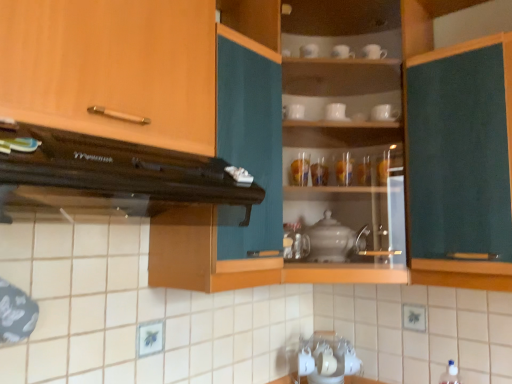
This screenshot has width=512, height=384. What do you see at coordinates (336, 112) in the screenshot? I see `white glossy cup at upper center, the third tableware viewed from the right` at bounding box center [336, 112].

What do you see at coordinates (319, 172) in the screenshot? This screenshot has width=512, height=384. I see `translucent glass vase at upper center, the 4th tableware positioned from the right` at bounding box center [319, 172].

Measure the distance between point (327, 177) and camera.

Point (327, 177) is 1.74 meters from camera.

Locate an element on the screen. Image resolution: width=512 pixels, height=384 pixels. satin silver teapot at center is located at coordinates (334, 240).

What is the approximate width of wooden cabinet at center?

The width of wooden cabinet at center is 61.81 centimeters.

What is the approximate width of white ceramic cup at upper center, marked as the 1th tableware in a right-to-left arrangement?

The width of white ceramic cup at upper center, marked as the 1th tableware in a right-to-left arrangement, is 3.53 inches.

Where is `white glossy cup at upper center, which is counted as the fourth tableware, starting from the left`? white glossy cup at upper center, which is counted as the fourth tableware, starting from the left is located at coordinates (336, 112).

From a real-world perspective, is translucent glass vase at center, the 2th tableware positioned from the left, on top of translucent glass vase at upper center, which is the second tableware from right to left?

Incorrect, from a real-world perspective, translucent glass vase at center, the 2th tableware positioned from the left, is lower than translucent glass vase at upper center, which is the second tableware from right to left.

The width and height of the screenshot is (512, 384). In order to click on the 3rd tableware to the right when counting from the translucent glass vase at center, positioned as the fifth tableware in right-to-left order in this screenshot , I will do `click(344, 169)`.

Could you tell me if translucent glass vase at center, positioned as the fifth tableware in right-to-left order, is turned towards translucent glass vase at upper center, the 5th tableware viewed from the left?

No, translucent glass vase at center, positioned as the fifth tableware in right-to-left order, is not turned towards translucent glass vase at upper center, the 5th tableware viewed from the left.

Is translucent glass vase at center, the 2th tableware positioned from the left, shorter than translucent glass vase at upper center, which is the second tableware from right to left?

In fact, translucent glass vase at center, the 2th tableware positioned from the left, may be taller than translucent glass vase at upper center, which is the second tableware from right to left.

Which object is further away from the camera taking this photo, white glossy cup at upper center, which is counted as the fourth tableware, starting from the left, or wooden cabinet at center?

white glossy cup at upper center, which is counted as the fourth tableware, starting from the left, is further from the camera.

In the scene shown: From the image's perspective, which is above, white glossy cup at upper center, the third tableware viewed from the right, or wooden cabinet at center?

white glossy cup at upper center, the third tableware viewed from the right, appears higher in the image.

Is white glossy cup at upper center, the third tableware viewed from the right, inside or outside of wooden cabinet at center?

white glossy cup at upper center, the third tableware viewed from the right, exists entirely within wooden cabinet at center.

Does point (243, 185) come farther from viewer compared to point (350, 163)?

No, (243, 185) is closer to viewer.

Measure the distance between dark brown wood range hood at upper left and translucent glass vase at upper center, which is the second tableware from right to left.

dark brown wood range hood at upper left and translucent glass vase at upper center, which is the second tableware from right to left, are 1.05 meters apart.

Based on the photo, could translucent glass vase at upper center, which is the second tableware from right to left, be considered to be inside dark brown wood range hood at upper left?

No.

Considering the relative sizes of dark brown wood range hood at upper left and translucent glass vase at upper center, which is the second tableware from right to left, in the image provided, is dark brown wood range hood at upper left bigger than translucent glass vase at upper center, which is the second tableware from right to left,?

Indeed, dark brown wood range hood at upper left has a larger size compared to translucent glass vase at upper center, which is the second tableware from right to left.

Is dark brown wood range hood at upper left shorter than wooden cabinet at center?

Correct, dark brown wood range hood at upper left is not as tall as wooden cabinet at center.

In the image, is dark brown wood range hood at upper left positioned in front of or behind wooden cabinet at center?

Visually, dark brown wood range hood at upper left is located in front of wooden cabinet at center.

From the image's perspective, who appears lower, dark brown wood range hood at upper left or wooden cabinet at center?

dark brown wood range hood at upper left, from the image's perspective.

Is point (127, 212) closer or farther from the camera than point (297, 211)?

Point (127, 212) is closer to the camera than point (297, 211).

From a real-world perspective, is translucent glass vase at upper center, the 4th tableware positioned from the right, positioned above or below white glossy cup at upper center, the third tableware viewed from the right?

From a real-world perspective, translucent glass vase at upper center, the 4th tableware positioned from the right, is physically below white glossy cup at upper center, the third tableware viewed from the right.

Between translucent glass vase at upper center, the 4th tableware positioned from the right, and white glossy cup at upper center, the third tableware viewed from the right, which one has more height?

translucent glass vase at upper center, the 4th tableware positioned from the right, is taller.

From the image's perspective, who appears lower, translucent glass vase at upper center, the 4th tableware positioned from the right, or white glossy cup at upper center, which is counted as the fourth tableware, starting from the left?

translucent glass vase at upper center, the 4th tableware positioned from the right, is shown below in the image.

Starting from the white glossy cup at upper center, which is counted as the fourth tableware, starting from the left, which tableware is the 1st one to the left? Please provide its 2D coordinates.

[(319, 172)]

Which is more to the left, white glossy cup at upper center, the third tableware viewed from the right, or translucent glass vase at center, positioned as the fifth tableware in right-to-left order?

From the viewer's perspective, translucent glass vase at center, positioned as the fifth tableware in right-to-left order, appears more on the left side.

How different are the orientations of white glossy cup at upper center, which is counted as the fourth tableware, starting from the left, and translucent glass vase at center, the 2th tableware positioned from the left, in degrees?

The angle between the facing direction of white glossy cup at upper center, which is counted as the fourth tableware, starting from the left, and the facing direction of translucent glass vase at center, the 2th tableware positioned from the left, is 0.205 degrees.

From a real-world perspective, count 5th tablewares downward from the white glossy cup at upper center, the third tableware viewed from the right, and point to it. Please provide its 2D coordinates.

[(300, 169)]

Is point (334, 104) positioned in front of point (304, 178)?

No.

Locate an element on the screen. This screenshot has width=512, height=384. cabinetry located on the right of translucent glass vase at upper center, the 5th tableware viewed from the left is located at coordinates coord(460,157).

Does translucent glass vase at upper center, which is the second tableware from right to left, have a lesser height compared to green felt board at right, arranged as the first cabinetry when viewed from the right?

Yes.

In the image, is translucent glass vase at upper center, which is the second tableware from right to left, on the left side or the right side of green felt board at right, which is the second cabinetry from left to right?

translucent glass vase at upper center, which is the second tableware from right to left, is positioned on green felt board at right, which is the second cabinetry from left to right,'s left side.

From the image's perspective, between translucent glass vase at upper center, which is the second tableware from right to left, and green felt board at right, which is the second cabinetry from left to right, which one is located above?

translucent glass vase at upper center, which is the second tableware from right to left, is shown above in the image.

Find the location of a particular element. This screenshot has width=512, height=384. the 1st tableware behind the translucent glass vase at center, the 2th tableware positioned from the left is located at coordinates (344, 169).

You are a GUI agent. You are given a task and a screenshot of the screen. Output one action in this format:
    pyautogui.click(x=<x>, y=<y>)
    Task: Click on the tableware that is the 1st object to the left of the wooden cabinet at center, starting at the anchor
    Image resolution: width=512 pixels, height=384 pixels.
    Given the screenshot: What is the action you would take?
    pyautogui.click(x=336, y=112)

From the image, which object appears to be farther from translucent glass vase at upper center, which is the second tableware from right to left, dark brown wood range hood at upper left or wooden cabinet at center?

Among the two, dark brown wood range hood at upper left is located further to translucent glass vase at upper center, which is the second tableware from right to left.

Which object lies further to the anchor point green felt board at right, arranged as the first cabinetry when viewed from the right, translucent glass vase at upper center, the 5th tableware viewed from the left, or wooden cabinet handle at upper left, which is the 2th cabinetry from right to left?

wooden cabinet handle at upper left, which is the 2th cabinetry from right to left, is positioned further to the anchor green felt board at right, arranged as the first cabinetry when viewed from the right.

Estimate the real-world distances between objects in this image. Which object is further from white ceramic cup at upper center, the sixth tableware positioned from the left, translucent glass vase at upper center, the 5th tableware viewed from the left, or white glossy cup at upper center, which is the sixth tableware from right to left?

Among the two, white glossy cup at upper center, which is the sixth tableware from right to left, is located further to white ceramic cup at upper center, the sixth tableware positioned from the left.

From the image, which object appears to be nearer to wooden cabinet handle at upper left, which is the 2th cabinetry from right to left, translucent glass vase at center, the 2th tableware positioned from the left, or wooden cabinet at center?

Based on the image, wooden cabinet at center appears to be nearer to wooden cabinet handle at upper left, which is the 2th cabinetry from right to left.

Estimate the real-world distances between objects in this image. Which object is further from white glossy cup at upper center, the third tableware viewed from the right, translucent glass vase at upper center, positioned as the 3th tableware in left-to-right order, or white glossy cup at upper center, which is the sixth tableware from right to left?

The object further to white glossy cup at upper center, the third tableware viewed from the right, is translucent glass vase at upper center, positioned as the 3th tableware in left-to-right order.

Based on their spatial positions, is white ceramic cup at upper center, marked as the 1th tableware in a right-to-left arrangement, or white glossy cup at upper center, which is the sixth tableware from right to left, closer to wooden cabinet handle at upper left, which is the 2th cabinetry from right to left?

The object closer to wooden cabinet handle at upper left, which is the 2th cabinetry from right to left, is white glossy cup at upper center, which is the sixth tableware from right to left.

Considering their positions, is wooden cabinet handle at upper left, which is the 2th cabinetry from right to left, positioned closer to translucent glass vase at center, the 2th tableware positioned from the left, than translucent glass vase at upper center, which is the second tableware from right to left?

Based on the image, translucent glass vase at upper center, which is the second tableware from right to left, appears to be nearer to translucent glass vase at center, the 2th tableware positioned from the left.

Based on their spatial positions, is translucent glass vase at upper center, which is the second tableware from right to left, or translucent glass vase at upper center, positioned as the 3th tableware in left-to-right order, closer to white glossy cup at upper center, which is the first tableware from left to right?

translucent glass vase at upper center, positioned as the 3th tableware in left-to-right order, lies closer to white glossy cup at upper center, which is the first tableware from left to right, than the other object.

At what (x,y) coordinates should I click in order to perform the action: click on appliance situated between translucent glass vase at upper center, the 4th tableware positioned from the right, and green felt board at right, arranged as the first cabinetry when viewed from the right, from left to right. Please return your answer as a coordinate pair (x, y). Looking at the image, I should click on (334, 240).

Image resolution: width=512 pixels, height=384 pixels. In order to click on cabinet between green felt board at right, arranged as the first cabinetry when viewed from the right, and translucent glass vase at upper center, positioned as the 3th tableware in left-to-right order, along the z-axis in this screenshot , I will do `click(346, 137)`.

At what (x,y) coordinates should I click in order to perform the action: click on appliance between wooden cabinet handle at upper left, arranged as the first cabinetry when viewed from the left, and translucent glass vase at center, positioned as the fifth tableware in right-to-left order, in the front-back direction. Please return your answer as a coordinate pair (x, y). Looking at the image, I should click on (334, 240).

In order to click on cabinet between dark brown wood range hood at upper left and green felt board at right, which is the second cabinetry from left to right, in the horizontal direction in this screenshot , I will do `click(346, 137)`.